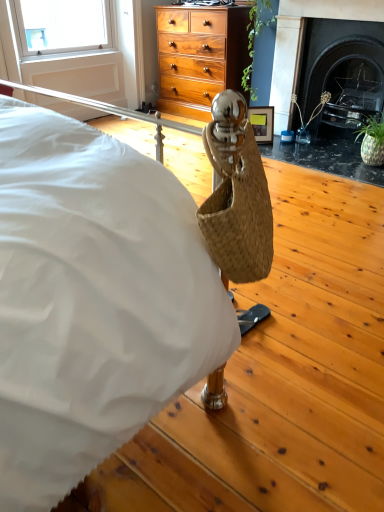
Where is `black marble fireplace at upper right`? black marble fireplace at upper right is located at coordinates (342, 70).

What do you see at coordinates (262, 123) in the screenshot? I see `wooden picture frame at center` at bounding box center [262, 123].

Where is `green leafy plant at upper center, the 2th plant from the bottom`? The width and height of the screenshot is (384, 512). green leafy plant at upper center, the 2th plant from the bottom is located at coordinates (259, 49).

Does clear glass vase at right, the 1th plant when ordered from right to left, have a lesser width compared to green leafy plant at upper center, the 2th plant from the bottom?

Indeed, clear glass vase at right, the 1th plant when ordered from right to left, has a lesser width compared to green leafy plant at upper center, the 2th plant from the bottom.

Is clear glass vase at right, the 1th plant when ordered from right to left, positioned beyond the bounds of green leafy plant at upper center, the first plant in the top-to-bottom sequence?

That's correct, clear glass vase at right, the 1th plant when ordered from right to left, is outside of green leafy plant at upper center, the first plant in the top-to-bottom sequence.

Considering the relative positions of clear glass vase at right, the 1th plant when ordered from right to left, and green leafy plant at upper center, the second plant positioned from the right, in the image provided, is clear glass vase at right, the 1th plant when ordered from right to left, to the right of green leafy plant at upper center, the second plant positioned from the right, from the viewer's perspective?

Correct, you'll find clear glass vase at right, the 1th plant when ordered from right to left, to the right of green leafy plant at upper center, the second plant positioned from the right.

Consider the image. Considering the relative sizes of clear glass vase at right, positioned as the second plant in left-to-right order, and green leafy plant at upper center, the first plant in the top-to-bottom sequence, in the image provided, is clear glass vase at right, positioned as the second plant in left-to-right order, taller than green leafy plant at upper center, the first plant in the top-to-bottom sequence,?

In fact, clear glass vase at right, positioned as the second plant in left-to-right order, may be shorter than green leafy plant at upper center, the first plant in the top-to-bottom sequence.

From the image's perspective, which is below, clear glass vase at right, placed as the second plant when sorted from top to bottom, or wooden picture frame at center?

wooden picture frame at center, from the image's perspective.

You are a GUI agent. You are given a task and a screenshot of the screen. Output one action in this format:
    pyautogui.click(x=<x>, y=<y>)
    Task: Click on the picture frame located on the left of clear glass vase at right, acting as the first plant starting from the bottom
    
    Given the screenshot: What is the action you would take?
    pyautogui.click(x=262, y=123)

Consider the image. Could wooden picture frame at center be considered to be inside clear glass vase at right, acting as the first plant starting from the bottom?

No, wooden picture frame at center is not inside clear glass vase at right, acting as the first plant starting from the bottom.

Which is farther, (300, 119) or (256, 139)?

Point (256, 139)

Between wooden picture frame at center and green leafy plant at upper center, the 2th plant from the bottom, which one has smaller width?

wooden picture frame at center.

In the scene shown: From a real-world perspective, does wooden picture frame at center stand above green leafy plant at upper center, the first plant in the top-to-bottom sequence?

No, from a real-world perspective, wooden picture frame at center is not over green leafy plant at upper center, the first plant in the top-to-bottom sequence

Who is bigger, wooden picture frame at center or green leafy plant at upper center, the 2th plant from the bottom?

green leafy plant at upper center, the 2th plant from the bottom, is bigger.

Is wooden picture frame at center looking in the opposite direction of green leafy plant at upper center, the first plant in the top-to-bottom sequence?

No, wooden picture frame at center's orientation is not away from green leafy plant at upper center, the first plant in the top-to-bottom sequence.

Does black marble fireplace at upper right turn towards clear glass vase at right, placed as the second plant when sorted from top to bottom?

Yes.

Who is bigger, black marble fireplace at upper right or clear glass vase at right, positioned as the second plant in left-to-right order?

black marble fireplace at upper right is bigger.

Between black marble fireplace at upper right and clear glass vase at right, placed as the second plant when sorted from top to bottom, which one appears on the left side from the viewer's perspective?

clear glass vase at right, placed as the second plant when sorted from top to bottom.

You are a GUI agent. You are given a task and a screenshot of the screen. Output one action in this format:
    pyautogui.click(x=<x>, y=<y>)
    Task: Click on the plant below the black marble fireplace at upper right (from the image's perspective)
    
    Given the screenshot: What is the action you would take?
    pyautogui.click(x=309, y=118)

Where is `picture frame on the left of black marble fireplace at upper right`? picture frame on the left of black marble fireplace at upper right is located at coordinates (262, 123).

Would you say black marble fireplace at upper right is a long distance from wooden picture frame at center?

No, black marble fireplace at upper right is not far away from wooden picture frame at center.

Does black marble fireplace at upper right contain wooden picture frame at center?

No, wooden picture frame at center is not surrounded by black marble fireplace at upper right.

Is black marble fireplace at upper right smaller than wooden picture frame at center?

Actually, black marble fireplace at upper right might be larger than wooden picture frame at center.

Can you confirm if green leafy plant at upper center, the first plant from the left, is thinner than wooden picture frame at center?

Incorrect, the width of green leafy plant at upper center, the first plant from the left, is not less than that of wooden picture frame at center.

Which is more to the left, green leafy plant at upper center, the first plant in the top-to-bottom sequence, or wooden picture frame at center?

Positioned to the left is green leafy plant at upper center, the first plant in the top-to-bottom sequence.

Is green leafy plant at upper center, the first plant from the left, taller or shorter than wooden picture frame at center?

green leafy plant at upper center, the first plant from the left, is taller than wooden picture frame at center.

At what (x,y) coordinates should I click in order to perform the action: click on plant located on the left of wooden picture frame at center. Please return your answer as a coordinate pair (x, y). Image resolution: width=384 pixels, height=512 pixels. Looking at the image, I should click on pyautogui.click(x=259, y=49).

Is clear glass vase at right, acting as the first plant starting from the bottom, oriented away from black marble fireplace at upper right?

→ Yes, black marble fireplace at upper right is at the back of clear glass vase at right, acting as the first plant starting from the bottom.

From a real-world perspective, which object stands above the other?

black marble fireplace at upper right, from a real-world perspective.

Consider the image. How different are the orientations of clear glass vase at right, acting as the first plant starting from the bottom, and black marble fireplace at upper right in degrees?

clear glass vase at right, acting as the first plant starting from the bottom, and black marble fireplace at upper right are facing 22.3 degrees away from each other.

Does point (306, 131) come closer to viewer compared to point (316, 93)?

No, it is behind (316, 93).

Image resolution: width=384 pixels, height=512 pixels. Find the location of `plant that is under the green leafy plant at upper center, the second plant positioned from the right (from a real-world perspective)`. plant that is under the green leafy plant at upper center, the second plant positioned from the right (from a real-world perspective) is located at coordinates click(x=309, y=118).

You are a GUI agent. You are given a task and a screenshot of the screen. Output one action in this format:
    pyautogui.click(x=<x>, y=<y>)
    Task: Click on the picture frame lying behind the clear glass vase at right, the 1th plant when ordered from right to left
    The image size is (384, 512).
    Given the screenshot: What is the action you would take?
    pyautogui.click(x=262, y=123)

Which object lies nearer to the anchor point green leafy plant at upper center, the second plant positioned from the right, wooden picture frame at center or black marble fireplace at upper right?

Among the two, wooden picture frame at center is located nearer to green leafy plant at upper center, the second plant positioned from the right.

Looking at this image, looking at the image, which one is located further to black marble fireplace at upper right, green leafy plant at upper center, the first plant from the left, or wooden picture frame at center?

The object further to black marble fireplace at upper right is wooden picture frame at center.

In the scene shown: Estimate the real-world distances between objects in this image. Which object is further from wooden picture frame at center, black marble fireplace at upper right or green leafy plant at upper center, the second plant positioned from the right?

black marble fireplace at upper right.

In the scene shown: Estimate the real-world distances between objects in this image. Which object is further from green leafy plant at upper center, the 2th plant from the bottom, wooden picture frame at center or clear glass vase at right, acting as the first plant starting from the bottom?

Based on the image, clear glass vase at right, acting as the first plant starting from the bottom, appears to be further to green leafy plant at upper center, the 2th plant from the bottom.

Looking at the image, which one is located closer to black marble fireplace at upper right, clear glass vase at right, the 1th plant when ordered from right to left, or wooden picture frame at center?

clear glass vase at right, the 1th plant when ordered from right to left, lies closer to black marble fireplace at upper right than the other object.

When comparing their distances from clear glass vase at right, the 1th plant when ordered from right to left, does black marble fireplace at upper right or green leafy plant at upper center, the second plant positioned from the right, seem closer?

black marble fireplace at upper right is closer to clear glass vase at right, the 1th plant when ordered from right to left.

From the image, which object appears to be farther from clear glass vase at right, positioned as the second plant in left-to-right order, green leafy plant at upper center, the 2th plant from the bottom, or black marble fireplace at upper right?

The object further to clear glass vase at right, positioned as the second plant in left-to-right order, is green leafy plant at upper center, the 2th plant from the bottom.

From the image, which object appears to be farther from black marble fireplace at upper right, green leafy plant at upper center, the 2th plant from the bottom, or clear glass vase at right, the 1th plant when ordered from right to left?

green leafy plant at upper center, the 2th plant from the bottom.

Identify the location of plant situated between green leafy plant at upper center, the first plant in the top-to-bottom sequence, and black marble fireplace at upper right from left to right. This screenshot has height=512, width=384. (309, 118).

Locate an element on the screen. This screenshot has width=384, height=512. picture frame situated between green leafy plant at upper center, the first plant in the top-to-bottom sequence, and black marble fireplace at upper right from left to right is located at coordinates (262, 123).

Identify the location of plant between wooden picture frame at center and black marble fireplace at upper right. tap(309, 118).

I want to click on plant between green leafy plant at upper center, the 2th plant from the bottom, and wooden picture frame at center vertically, so click(x=309, y=118).